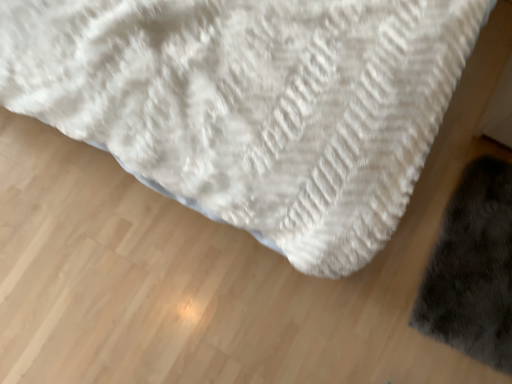
Describe the element at coordinates (472, 268) in the screenshot. I see `dark gray fluffy mat at lower right` at that location.

At what (x,y) coordinates should I click in order to perform the action: click on dark gray fluffy mat at lower right. Please return your answer as a coordinate pair (x, y). Image resolution: width=512 pixels, height=384 pixels. Looking at the image, I should click on (472, 268).

What is the approximate height of white fluffy towel at center?

white fluffy towel at center is 86.57 centimeters tall.

Describe the element at coordinates (253, 103) in the screenshot. Image resolution: width=512 pixels, height=384 pixels. I see `white fluffy towel at center` at that location.

Find the location of a particular element. The width and height of the screenshot is (512, 384). white fluffy towel at center is located at coordinates (253, 103).

I want to click on dark gray fluffy mat at lower right, so click(472, 268).

From the picture: Considering the relative positions of dark gray fluffy mat at lower right and white fluffy towel at center in the image provided, is dark gray fluffy mat at lower right to the right of white fluffy towel at center from the viewer's perspective?

Yes.

Is dark gray fluffy mat at lower right positioned behind white fluffy towel at center?

Yes, dark gray fluffy mat at lower right is further from the camera.

Which is in front, point (475, 259) or point (320, 189)?

The point (320, 189) is closer.

From the image's perspective, between dark gray fluffy mat at lower right and white fluffy towel at center, which one is located above?

white fluffy towel at center is shown above in the image.

From a real-world perspective, is dark gray fluffy mat at lower right under white fluffy towel at center?

Indeed, from a real-world perspective, dark gray fluffy mat at lower right is positioned beneath white fluffy towel at center.

Is dark gray fluffy mat at lower right thinner than white fluffy towel at center?

Indeed, dark gray fluffy mat at lower right has a lesser width compared to white fluffy towel at center.

Between dark gray fluffy mat at lower right and white fluffy towel at center, which one has more height?

white fluffy towel at center is taller.

Is dark gray fluffy mat at lower right smaller than white fluffy towel at center?

Yes, dark gray fluffy mat at lower right is smaller than white fluffy towel at center.

Which is correct: dark gray fluffy mat at lower right is inside white fluffy towel at center, or outside of it?

dark gray fluffy mat at lower right exists outside the volume of white fluffy towel at center.

Can you see dark gray fluffy mat at lower right touching white fluffy towel at center?

dark gray fluffy mat at lower right is not next to white fluffy towel at center, and they're not touching.

Could you tell me if dark gray fluffy mat at lower right is turned towards white fluffy towel at center?

No, dark gray fluffy mat at lower right does not turn towards white fluffy towel at center.

How many degrees apart are the facing directions of dark gray fluffy mat at lower right and white fluffy towel at center?

dark gray fluffy mat at lower right and white fluffy towel at center are facing 88 degrees away from each other.

You are a GUI agent. You are given a task and a screenshot of the screen. Output one action in this format:
    pyautogui.click(x=<x>, y=<y>)
    Task: Click on the towel on the left of dark gray fluffy mat at lower right
    Image resolution: width=512 pixels, height=384 pixels.
    Given the screenshot: What is the action you would take?
    pyautogui.click(x=253, y=103)

Which object is positioned more to the left, white fluffy towel at center or dark gray fluffy mat at lower right?

Positioned to the left is white fluffy towel at center.

Which is in front, white fluffy towel at center or dark gray fluffy mat at lower right?

white fluffy towel at center is more forward.

Does point (283, 76) come behind point (483, 282)?

No, (283, 76) is in front of (483, 282).

From the image's perspective, would you say white fluffy towel at center is shown under dark gray fluffy mat at lower right?

No, from the image's perspective, white fluffy towel at center is not beneath dark gray fluffy mat at lower right.

From a real-world perspective, is white fluffy towel at center below dark gray fluffy mat at lower right?

No, from a real-world perspective, white fluffy towel at center is not below dark gray fluffy mat at lower right.

Considering the relative sizes of white fluffy towel at center and dark gray fluffy mat at lower right in the image provided, is white fluffy towel at center thinner than dark gray fluffy mat at lower right?

In fact, white fluffy towel at center might be wider than dark gray fluffy mat at lower right.

Considering the sizes of objects white fluffy towel at center and dark gray fluffy mat at lower right in the image provided, who is shorter, white fluffy towel at center or dark gray fluffy mat at lower right?

dark gray fluffy mat at lower right.

Who is smaller, white fluffy towel at center or dark gray fluffy mat at lower right?

dark gray fluffy mat at lower right.

Is white fluffy towel at center not inside dark gray fluffy mat at lower right?

Yes, white fluffy towel at center is not within dark gray fluffy mat at lower right.

Looking at this image, are white fluffy towel at center and dark gray fluffy mat at lower right located far from each other?

white fluffy towel at center is actually quite close to dark gray fluffy mat at lower right.

In the scene shown: Is white fluffy towel at center oriented towards dark gray fluffy mat at lower right?

Yes, white fluffy towel at center is turned towards dark gray fluffy mat at lower right.

Based on the photo, how much distance is there between white fluffy towel at center and dark gray fluffy mat at lower right?

They are 60.23 centimeters apart.

I want to click on towel that appears above the dark gray fluffy mat at lower right (from a real-world perspective), so click(x=253, y=103).

Locate an element on the screen. This screenshot has height=384, width=512. towel above the dark gray fluffy mat at lower right (from the image's perspective) is located at coordinates pyautogui.click(x=253, y=103).

The height and width of the screenshot is (384, 512). I want to click on mat lying behind the white fluffy towel at center, so click(x=472, y=268).